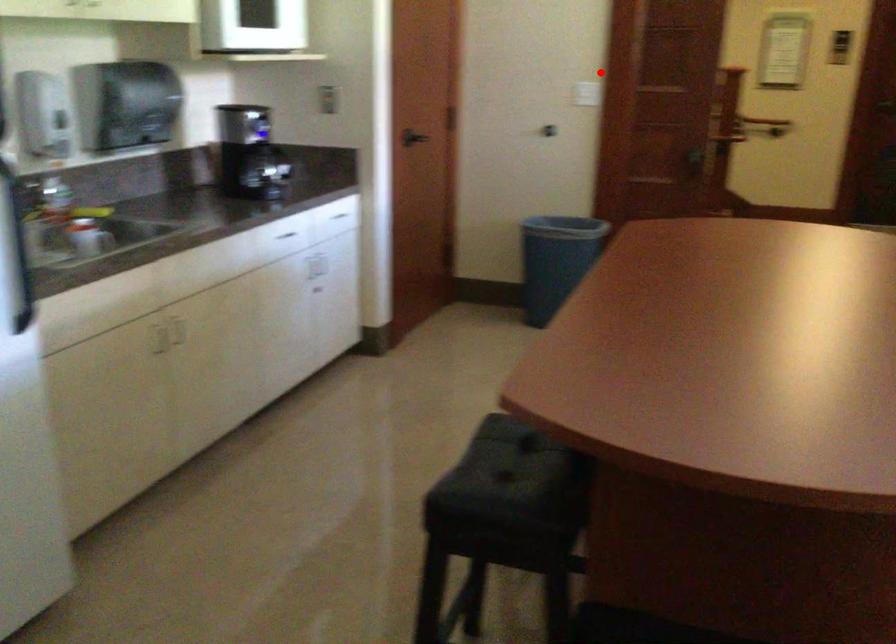
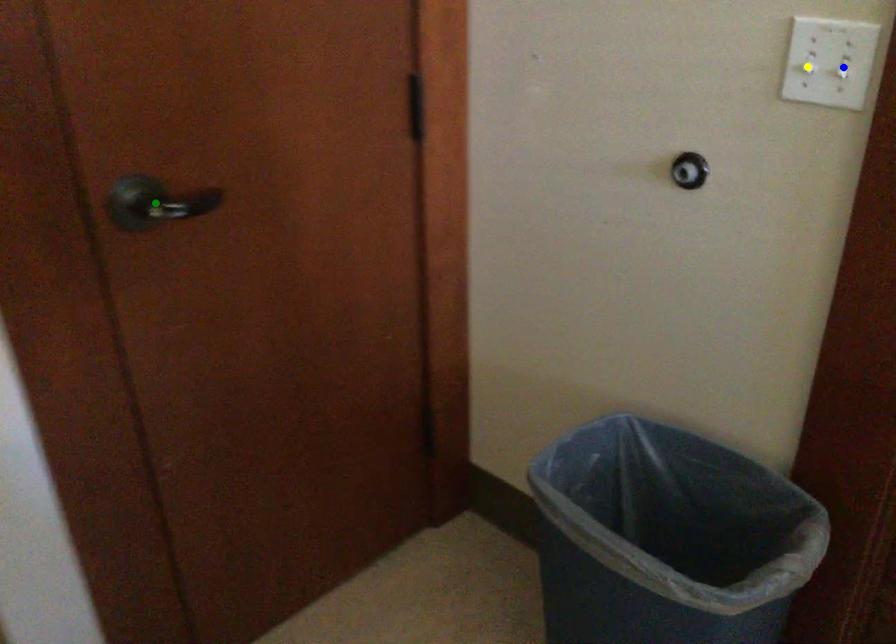
Question: I am providing you with two images of the same scene from different viewpoints. A red point is marked on the first image. You are given multiple points on the second image. Which mark in image 2 goes with the point in image 1?

Choices:
 (A) blue point
 (B) green point
 (C) yellow point

Answer: (C)